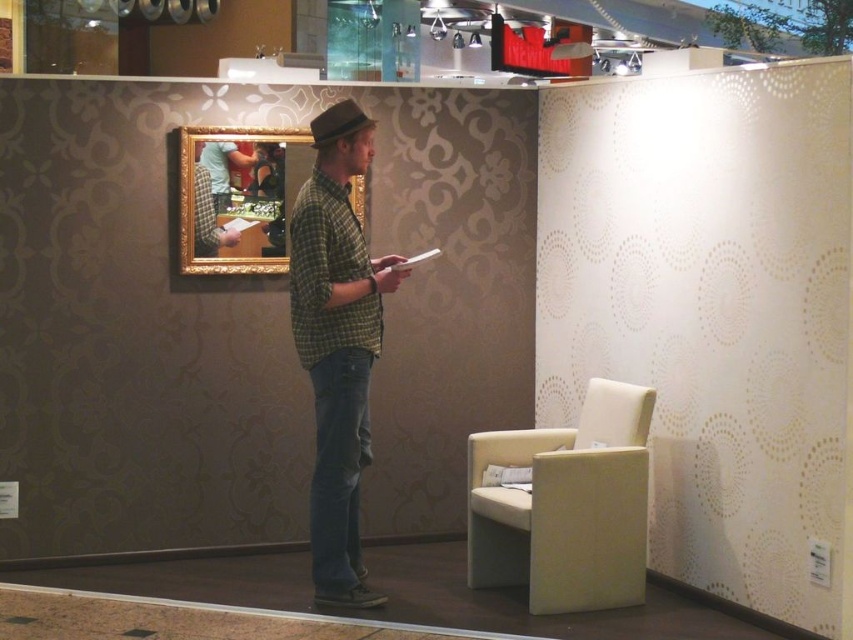
Question: Which object is the closest to the beige fabric armchair at lower right?

Choices:
 (A) brown felt fedora at center
 (B) green plaid shirt at center

Answer: (B)

Question: Where is beige fabric armchair at lower right located in relation to green plaid shirt at center in the image?

Choices:
 (A) below
 (B) above

Answer: (A)

Question: Which object appears closest to the camera in this image?

Choices:
 (A) beige fabric armchair at lower right
 (B) brown felt fedora at center

Answer: (B)

Question: Is green plaid shirt at center positioned in front of brown felt fedora at center?

Choices:
 (A) no
 (B) yes

Answer: (B)

Question: Estimate the real-world distances between objects in this image. Which object is farther from the green plaid shirt at center?

Choices:
 (A) brown felt fedora at center
 (B) beige fabric armchair at lower right

Answer: (B)

Question: Is beige fabric armchair at lower right to the right of green plaid shirt at center from the viewer's perspective?

Choices:
 (A) yes
 (B) no

Answer: (A)